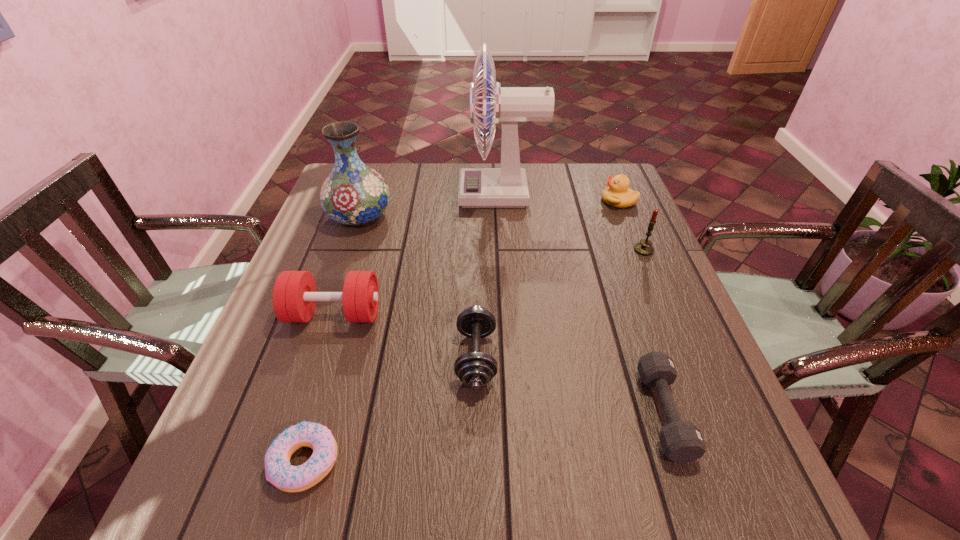
The width and height of the screenshot is (960, 540). In order to click on fan in this screenshot , I will do `click(506, 186)`.

Identify the location of the seventh shortest object. (353, 194).

Locate an element on the screen. The width and height of the screenshot is (960, 540). candle is located at coordinates (644, 247).

The image size is (960, 540). Identify the location of the tallest dumbbell. (294, 294).

Image resolution: width=960 pixels, height=540 pixels. In order to click on duckling in this screenshot , I will do `click(618, 194)`.

Identify the location of the second dumbbell from left to right. The height and width of the screenshot is (540, 960). (475, 369).

Identify the location of the seventh tallest object. This screenshot has width=960, height=540. (681, 441).

Where is `the rightmost dumbbell`? the rightmost dumbbell is located at coordinates (681, 441).

Identify the location of doughnut. (278, 470).

Where is `vacant space located 0.190m on the front-facing side of the tallest object`? The height and width of the screenshot is (540, 960). vacant space located 0.190m on the front-facing side of the tallest object is located at coordinates (397, 194).